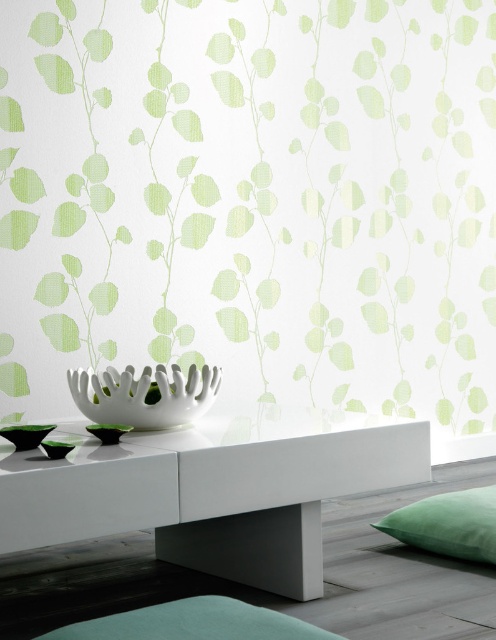
You are arranging a small tray of snacks and want to place it on the teal fabric mat at lower center or the green velvet cushion at lower right. Which surface has a larger width to accommodate the tray?

The teal fabric mat at lower center might be wider than green velvet cushion at lower right, so it could provide more space for the tray.

You are an interior designer assessing the space. You need to determine if the green leafy wallpaper at upper center can accommodate a decorative item that requires a width larger than the green velvet cushion at lower right. Can it?

The green leafy wallpaper at upper center might be wider than the green velvet cushion at lower right, so it could potentially accommodate a decorative item requiring a larger width.